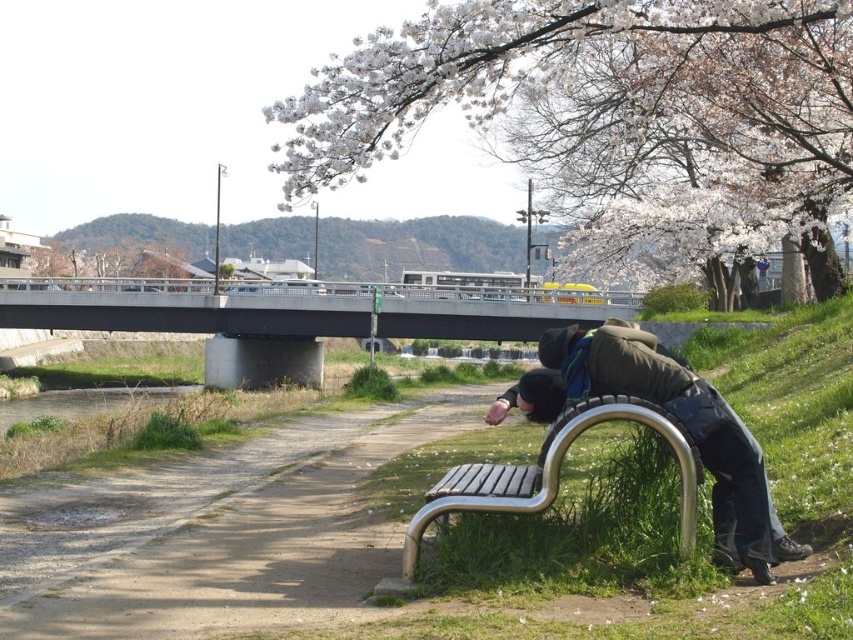
You are standing at the edge of the dirt path at lower left and want to reach the matte green jacket at lower right. Which direction should you move to get closer to the jacket?

Since the dirt path at lower left is closer to the viewer than the matte green jacket at lower right, you should move forward towards the jacket to get closer.

You are standing at point (245,548) in the image. What is the closest object to you?

The closest object to you at point (245,548) is the dirt path at lower left.